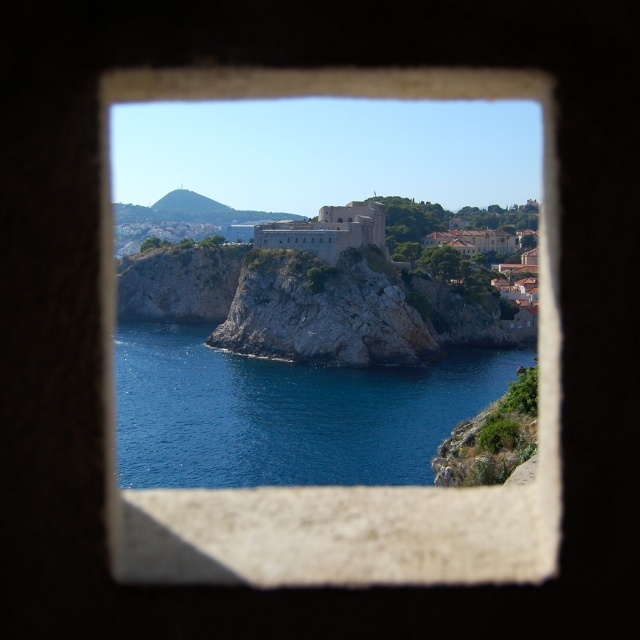
Question: Can you confirm if smooth stone window at center is positioned to the right of blue water at center?

Choices:
 (A) no
 (B) yes

Answer: (A)

Question: Based on their relative distances, which object is nearer to the gray stone fort at center?

Choices:
 (A) rocky cliff at center
 (B) blue water at center
 (C) smooth stone window at center

Answer: (A)

Question: Which object is closer to the camera taking this photo?

Choices:
 (A) rocky cliff at center
 (B) blue water at center
 (C) smooth stone window at center

Answer: (C)

Question: Among these points, which one is nearest to the camera?

Choices:
 (A) (275, 317)
 (B) (221, 458)
 (C) (369, 508)

Answer: (C)

Question: Can you confirm if smooth stone window at center is positioned below blue water at center?

Choices:
 (A) yes
 (B) no

Answer: (B)

Question: From the image, what is the correct spatial relationship of smooth stone window at center in relation to blue water at center?

Choices:
 (A) above
 (B) below

Answer: (A)